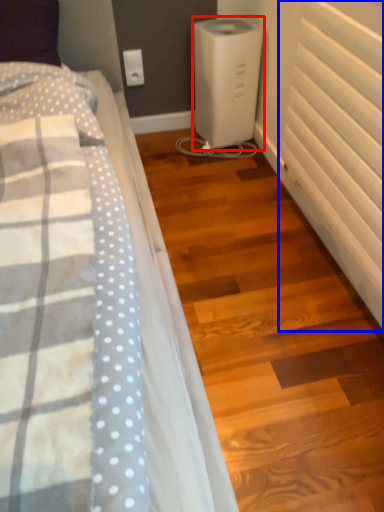
Question: Among these objects, which one is nearest to the camera, home appliance (highlighted by a red box) or radiator (highlighted by a blue box)?

Choices:
 (A) home appliance
 (B) radiator

Answer: (B)